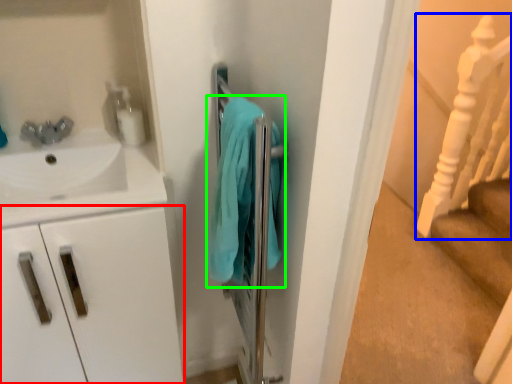
Question: Which object is positioned closest to drawer (highlighted by a red box)? Select from rail (highlighted by a blue box) and bath towel (highlighted by a green box).

Choices:
 (A) rail
 (B) bath towel

Answer: (B)